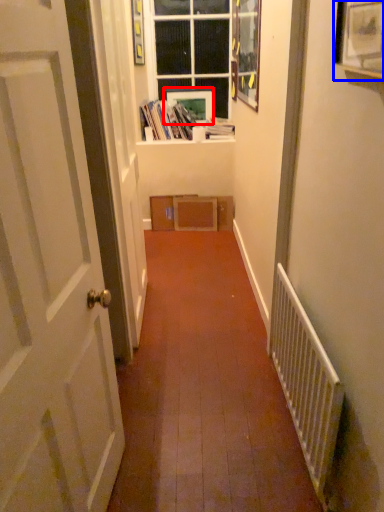
Question: Which of the following is the closest to the observer, picture frame (highlighted by a red box) or picture frame (highlighted by a blue box)?

Choices:
 (A) picture frame
 (B) picture frame

Answer: (B)